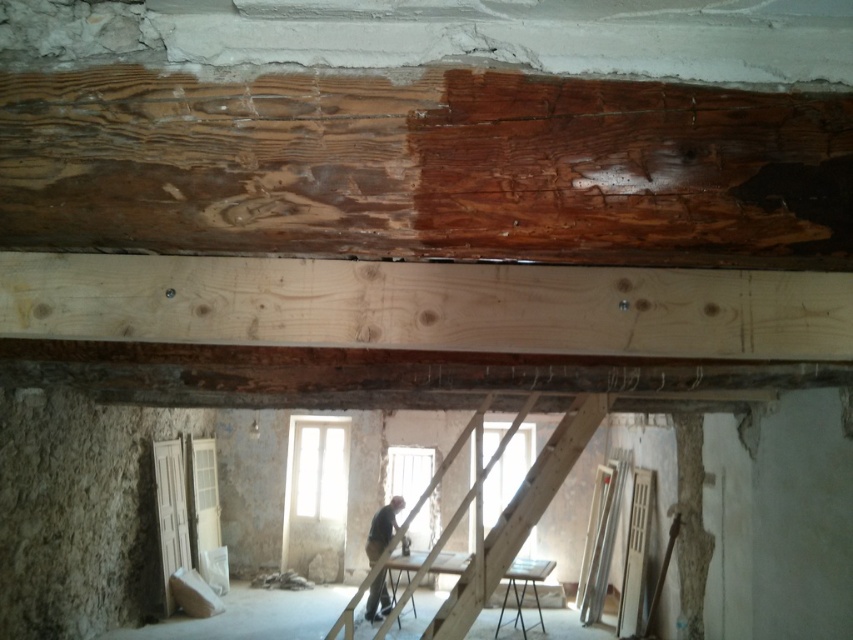
Question: Which object is positioned farthest from the natural wood plank at center?

Choices:
 (A) dark gray fabric shirt at center
 (B) natural wood beam at center

Answer: (A)

Question: Does natural wood plank at center appear under wooden at center?

Choices:
 (A) yes
 (B) no

Answer: (B)

Question: Can you confirm if natural wood beam at center is positioned below dark gray fabric shirt at center?

Choices:
 (A) no
 (B) yes

Answer: (A)

Question: Does natural wood plank at center have a smaller size compared to wooden at center?

Choices:
 (A) no
 (B) yes

Answer: (B)

Question: Which point is closer to the camera?

Choices:
 (A) dark gray fabric shirt at center
 (B) wooden at center

Answer: (B)

Question: Which point is farther to the camera?

Choices:
 (A) (381, 618)
 (B) (479, 605)
 (C) (477, 204)
 (D) (267, 266)

Answer: (A)